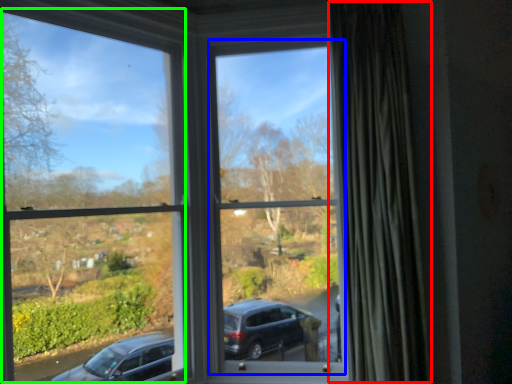
Question: Which is farther away from curtain (highlighted by a red box)? window frame (highlighted by a blue box) or window frame (highlighted by a green box)?

Choices:
 (A) window frame
 (B) window frame

Answer: (B)